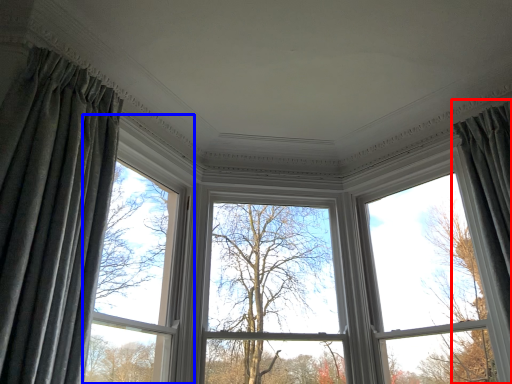
Question: Which point is further to the camera, curtain (highlighted by a red box) or window (highlighted by a blue box)?

Choices:
 (A) curtain
 (B) window

Answer: (B)